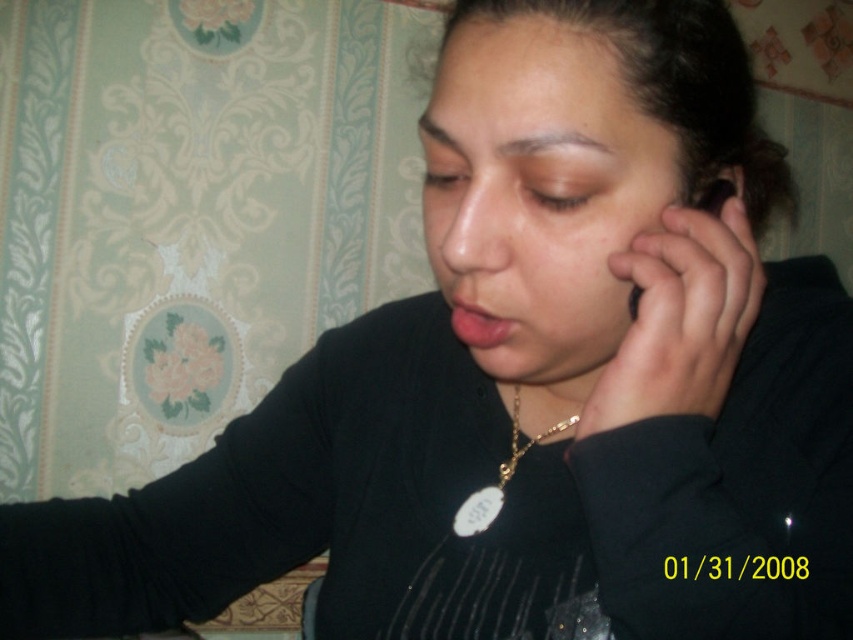
You are a photographer standing in front of the smooth skin at right. You want to take a closeup shot of it. The camera you are using has a minimum focusing distance of 12 inches. Will you be able to take the closeup shot without moving closer?

The distance between the smooth skin at right and the viewer is 14.76 inches. Since the minimum focusing distance of the camera is 12 inches, you can take the closeup shot without moving closer because the current distance is within the camera

You are a photographer analyzing the composition of this image. You notice the matte skin nose at center and the gold chain at center. Which object is taller in the image?

The matte skin nose at center is taller than the gold chain at center.